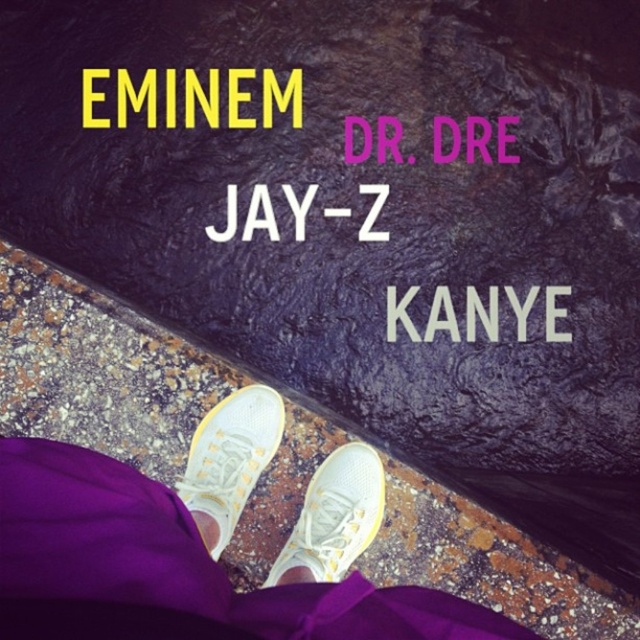
You are designing a poster and need to place the yellow metallic text at upper center and the white mesh sneakers at center. According to the image, which object should be placed first if you want the text to be smaller than the sneakers?

The white mesh sneakers at center is wider than the yellow metallic text at upper center, so you should place the yellow metallic text at upper center first since it is smaller in width compared to the sneakers.

You are designing a poster and need to ensure the pink matte text at center and white matte text at center are legible from a distance. Which text will be harder to read and why?

The pink matte text at center will be harder to read because it is thinner than the white matte text at center, making its strokes less distinct at a distance.

You are a photographer trying to capture the sneakers in the center. The camera is set to focus on the point with coordinates 0.719 on the x axis and 0.359 on the y axis. Will the white canvas sneakers at center be in focus?

Yes, the white canvas sneakers at center are exactly at the point (228, 460), so they will be in focus.